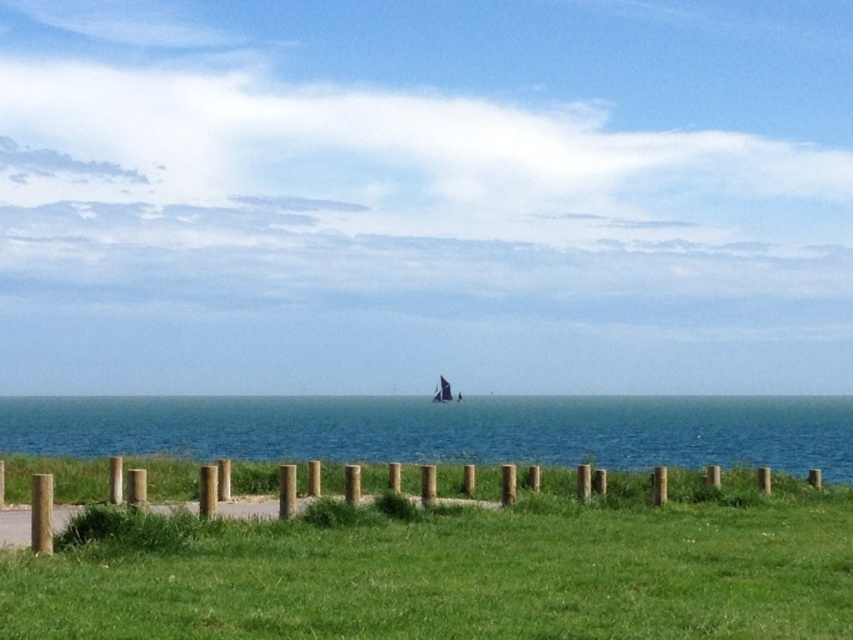
You are standing on the pathway and want to reach the green grass at center. Which direction should you move relative to the wooden posts at center?

The green grass at center is to the right of wooden posts at center, so you should move to the right of the wooden posts at center to reach it.

You are planning to build a small garden between the blue water at center and the wooden posts at center. Which area has more space available for planting?

The blue water at center is bigger than the wooden posts at center, so the area near the blue water at center has more space available for planting.